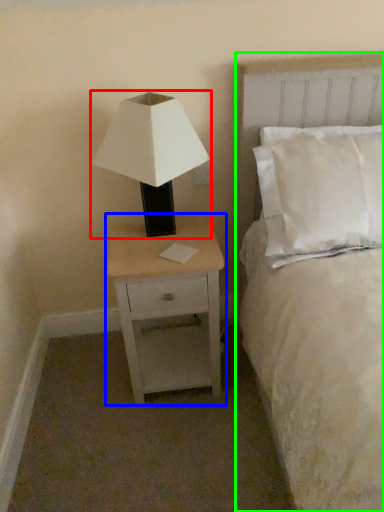
Question: Estimate the real-world distances between objects in this image. Which object is closer to lamp (highlighted by a red box), nightstand (highlighted by a blue box) or bed (highlighted by a green box)?

Choices:
 (A) nightstand
 (B) bed

Answer: (A)